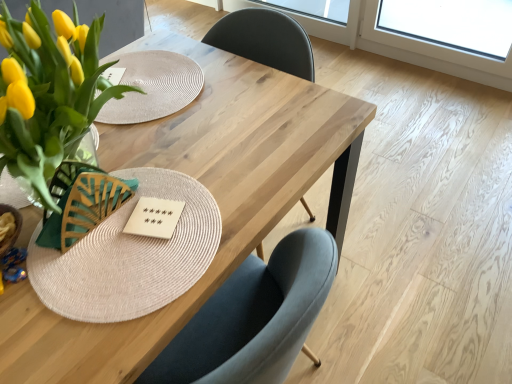
Question: Is matte glass vase with yellow tulips at left taller or shorter than natural wood table at center?

Choices:
 (A) tall
 (B) short

Answer: (B)

Question: In terms of width, does matte glass vase with yellow tulips at left look wider or thinner when compared to natural wood table at center?

Choices:
 (A) thin
 (B) wide

Answer: (A)

Question: Which is nearer to the wooden card game at center?

Choices:
 (A) transparent glass window screen at upper center
 (B) natural wood table at center
 (C) matte glass vase with yellow tulips at left

Answer: (C)

Question: Which of these objects is positioned farthest from the transparent glass window screen at upper center?

Choices:
 (A) wooden card game at center
 (B) matte glass vase with yellow tulips at left
 (C) natural wood table at center

Answer: (A)